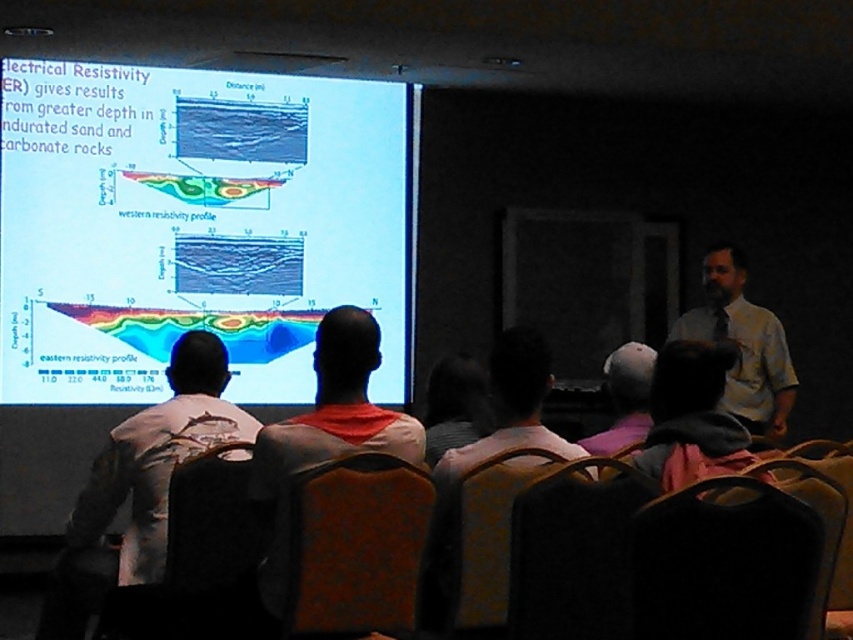
Consider the image. Is white glossy projection screen at upper center closer to the viewer compared to brown fabric chair at center?

That is False.

Between point (310, 385) and point (291, 500), which one is positioned in front?

Point (291, 500) is in front.

Between point (403, 195) and point (386, 493), which one is positioned behind?

Point (403, 195)

Find the location of a particular element. white glossy projection screen at upper center is located at coordinates pos(195,225).

Based on the photo, can you confirm if black fabric chair at lower right is bigger than velvet black chair at lower center?

Yes.

Between point (805, 547) and point (589, 502), which one is positioned behind?

The point (589, 502) is behind.

At what (x,y) coordinates should I click in order to perform the action: click on black fabric chair at lower right. Please return your answer as a coordinate pair (x, y). Looking at the image, I should click on (733, 561).

Is point (234, 253) positioned behind point (212, 577)?

That is True.

Does white glossy projection screen at upper center have a lesser height compared to velvet brown chair at lower left?

No.

Between point (120, 163) and point (213, 518), which one is positioned behind?

The point (120, 163) is behind.

At what (x,y) coordinates should I click in order to perform the action: click on white glossy projection screen at upper center. Please return your answer as a coordinate pair (x, y). The height and width of the screenshot is (640, 853). Looking at the image, I should click on (195, 225).